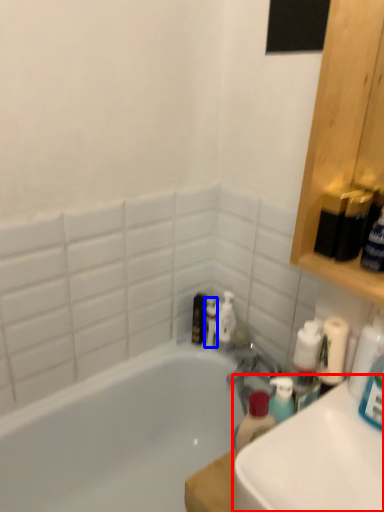
Question: Among these objects, which one is nearest to the camera, counter top (highlighted by a red box) or toiletry (highlighted by a blue box)?

Choices:
 (A) counter top
 (B) toiletry

Answer: (A)